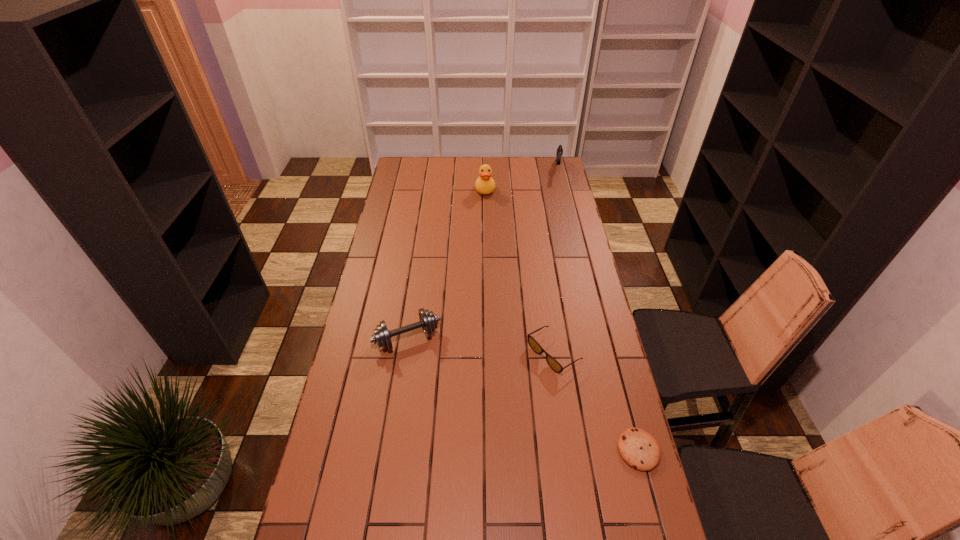
Find the location of a particular element. The image size is (960, 540). vacant space located on the back of the cookie is located at coordinates tap(623, 392).

This screenshot has height=540, width=960. Find the location of `vacant space located 0.270m on the front-facing side of the sunglasses`. vacant space located 0.270m on the front-facing side of the sunglasses is located at coordinates (468, 411).

I want to click on vacant space located 0.070m on the front-facing side of the sunglasses, so click(517, 379).

The image size is (960, 540). Identify the location of vacant region located on the front-facing side of the sunglasses. (522, 375).

This screenshot has width=960, height=540. In order to click on vacant area situated 0.180m at the beak of the fourth nearest object in this screenshot , I will do `click(488, 219)`.

Locate an element on the screen. Image resolution: width=960 pixels, height=540 pixels. vacant area situated 0.360m at the beak of the fourth nearest object is located at coordinates (490, 244).

Find the location of `vacant space located 0.250m at the beak of the fourth nearest object`. vacant space located 0.250m at the beak of the fourth nearest object is located at coordinates (488, 228).

At what (x,y) coordinates should I click in order to perform the action: click on vacant space situated 0.050m at the end of the barrel of the gun. Please return your answer as a coordinate pair (x, y). Looking at the image, I should click on (559, 185).

The width and height of the screenshot is (960, 540). In order to click on free space located at the end of the barrel of the gun in this screenshot , I will do `click(557, 198)`.

Where is `free space located at the end of the barrel of the gun`? This screenshot has width=960, height=540. free space located at the end of the barrel of the gun is located at coordinates (556, 212).